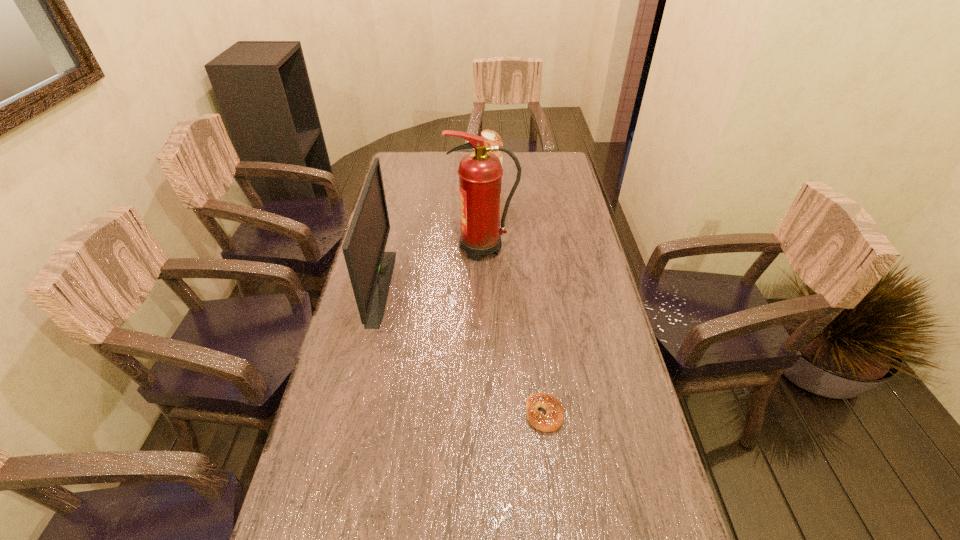
Identify the location of vacant area located 0.320m on the front-facing side of the leftmost object. The height and width of the screenshot is (540, 960). (492, 287).

You are a GUI agent. You are given a task and a screenshot of the screen. Output one action in this format:
    pyautogui.click(x=<x>, y=<y>)
    Task: Click on the free space located on the back of the burrito
    
    Given the screenshot: What is the action you would take?
    pyautogui.click(x=491, y=174)

The image size is (960, 540). What are the coordinates of `vacant space located 0.320m on the left of the nearest object` in the screenshot? It's located at [393, 414].

Locate an element on the screen. object located in the left edge section of the desktop is located at coordinates (370, 269).

At what (x,y) coordinates should I click in order to perform the action: click on free space at the left edge of the desktop. Please return your answer as a coordinate pair (x, y). The width and height of the screenshot is (960, 540). Looking at the image, I should click on (380, 406).

I want to click on free space at the right edge of the desktop, so click(x=679, y=534).

Locate an element on the screen. The height and width of the screenshot is (540, 960). free region at the far left corner of the desktop is located at coordinates (428, 156).

Locate an element on the screen. The width and height of the screenshot is (960, 540). vacant space that's between the shortest object and the third shortest object is located at coordinates (463, 350).

This screenshot has height=540, width=960. In order to click on vacant space that is in between the bagel and the third tallest object in this screenshot , I will do `click(518, 304)`.

Find the location of a particular element. The image size is (960, 540). vacant region between the monitor and the tallest object is located at coordinates (432, 267).